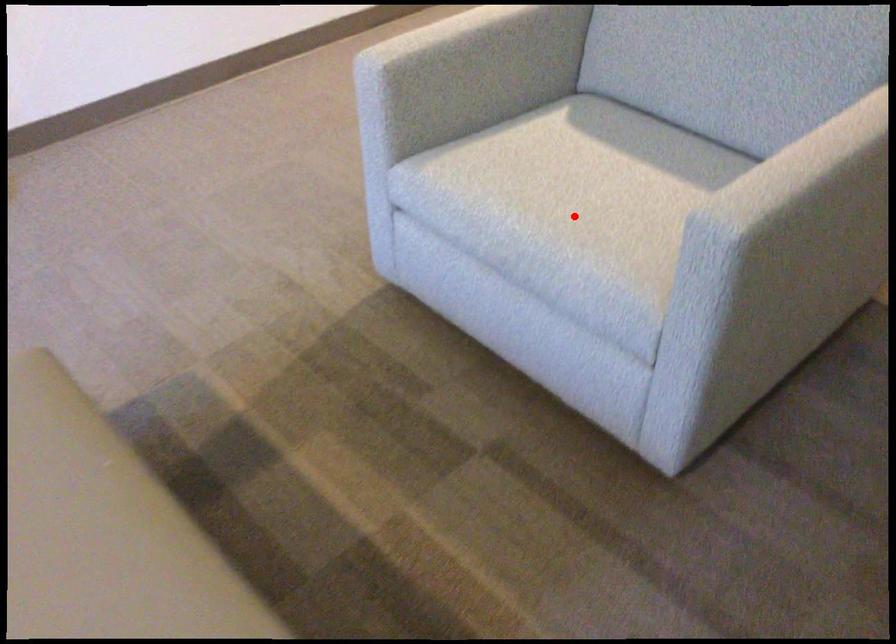
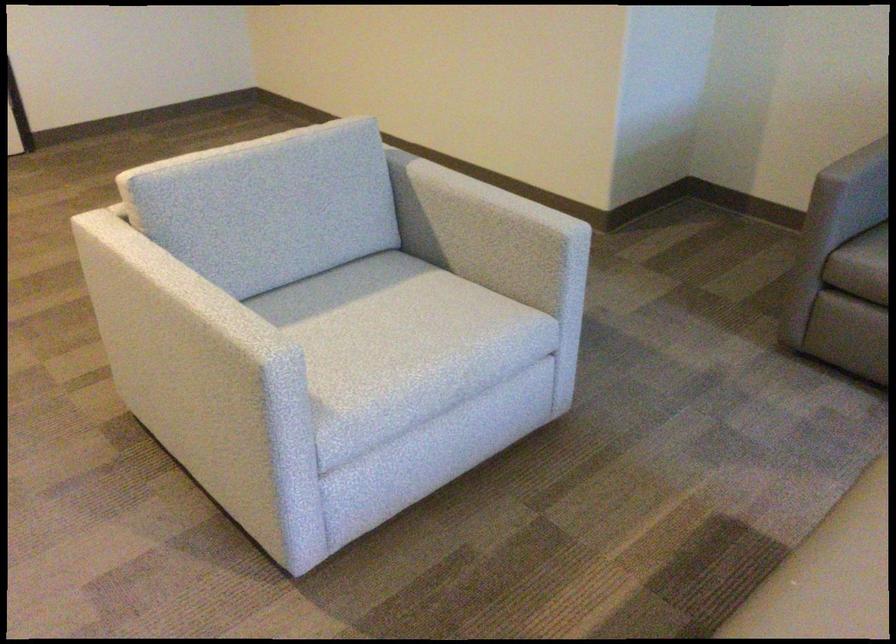
Question: I am providing you with two images of the same scene from different viewpoints. A red point is shown in image1. For the corresponding object point in image2, is it positioned nearer or farther from the camera?

Choices:
 (A) Nearer
 (B) Farther

Answer: (B)